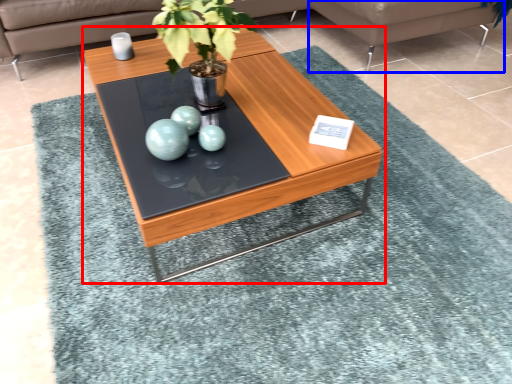
Question: Among these objects, which one is nearest to the camera, coffee table (highlighted by a red box) or couch (highlighted by a blue box)?

Choices:
 (A) coffee table
 (B) couch

Answer: (A)